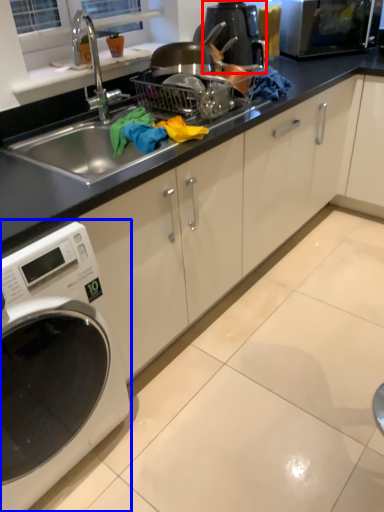
Question: Among these objects, which one is farthest to the camera, coffee machine (highlighted by a red box) or home appliance (highlighted by a blue box)?

Choices:
 (A) coffee machine
 (B) home appliance

Answer: (A)